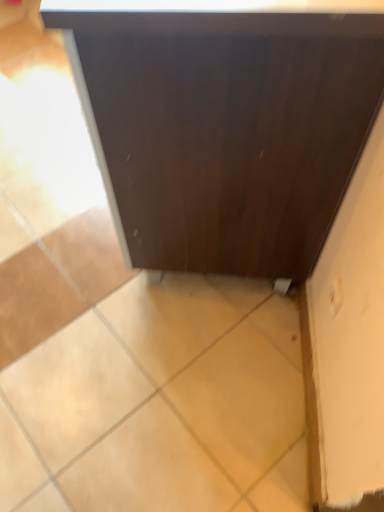
You are a GUI agent. You are given a task and a screenshot of the screen. Output one action in this format:
    pyautogui.click(x=<x>, y=<y>)
    Task: Click on the white glossy electric outlet at lower right
    The height and width of the screenshot is (512, 384).
    Given the screenshot: What is the action you would take?
    pyautogui.click(x=335, y=295)

Measure the distance between point (333, 285) and camera.

Point (333, 285) is 36.93 inches away from camera.

This screenshot has height=512, width=384. What do you see at coordinates (335, 295) in the screenshot?
I see `white glossy electric outlet at lower right` at bounding box center [335, 295].

You are a GUI agent. You are given a task and a screenshot of the screen. Output one action in this format:
    pyautogui.click(x=<x>, y=<y>)
    Task: Click on the white glossy electric outlet at lower right
    
    Given the screenshot: What is the action you would take?
    pyautogui.click(x=335, y=295)